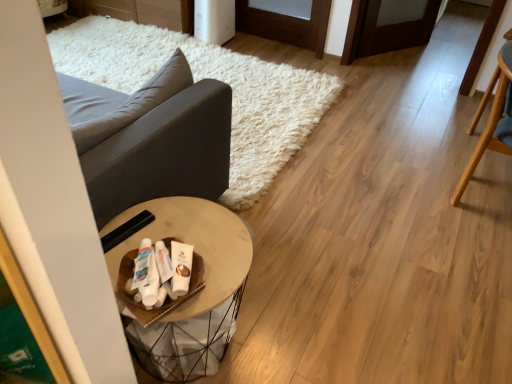
Find the location of `free area behind white glossy tube at center, the 2th toiletry from the left`. free area behind white glossy tube at center, the 2th toiletry from the left is located at coordinates (177, 230).